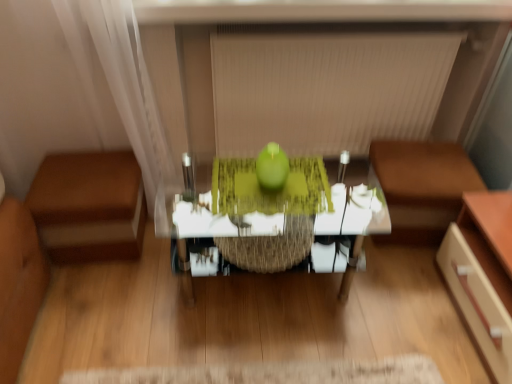
Question: From a real-world perspective, is beige fabric blind at upper center under translucent glass table at center?

Choices:
 (A) no
 (B) yes

Answer: (A)

Question: Is translucent glass table at center surrounded by beige fabric blind at upper center?

Choices:
 (A) no
 (B) yes

Answer: (A)

Question: Would you say beige fabric blind at upper center is outside translucent glass table at center?

Choices:
 (A) yes
 (B) no

Answer: (A)

Question: From the image's perspective, is beige fabric blind at upper center on top of translucent glass table at center?

Choices:
 (A) yes
 (B) no

Answer: (A)

Question: Does beige fabric blind at upper center have a greater height compared to translucent glass table at center?

Choices:
 (A) yes
 (B) no

Answer: (A)

Question: Is beige fabric blind at upper center smaller than translucent glass table at center?

Choices:
 (A) no
 (B) yes

Answer: (B)

Question: Could you tell me if green matte apple at center is turned towards brown leather couch at right, which ranks as the second furniture in left-to-right order?

Choices:
 (A) yes
 (B) no

Answer: (B)

Question: Is green matte apple at center at the right side of brown leather couch at right, which ranks as the second furniture in left-to-right order?

Choices:
 (A) yes
 (B) no

Answer: (B)

Question: Does green matte apple at center have a larger size compared to brown leather couch at right, which ranks as the second furniture in left-to-right order?

Choices:
 (A) no
 (B) yes

Answer: (A)

Question: From a real-world perspective, is green matte apple at center located beneath brown leather couch at right, the 1th furniture from the right?

Choices:
 (A) yes
 (B) no

Answer: (B)

Question: Is green matte apple at center positioned with its back to brown leather couch at right, the 1th furniture from the right?

Choices:
 (A) no
 (B) yes

Answer: (A)

Question: Considering the relative sizes of green matte apple at center and brown leather couch at right, the 1th furniture from the right, in the image provided, is green matte apple at center smaller than brown leather couch at right, the 1th furniture from the right,?

Choices:
 (A) no
 (B) yes

Answer: (B)

Question: Can you confirm if beige fabric blind at upper center is smaller than brown leather ottoman at left, which is the 2th furniture from right to left?

Choices:
 (A) no
 (B) yes

Answer: (A)